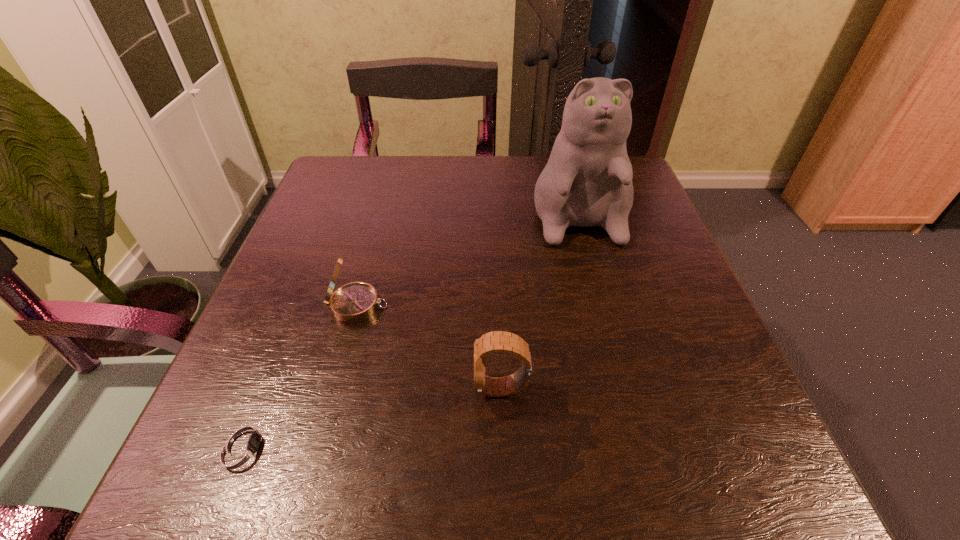
This screenshot has width=960, height=540. Identify the location of unoccupied area between the shortest object and the rightmost object. (409, 322).

Find the location of a particular element. This screenshot has width=960, height=540. vacant space that's between the taller watch and the leftmost object is located at coordinates (372, 417).

At what (x,y) coordinates should I click in order to perform the action: click on vacant space in between the shorter watch and the second object from right to left. Please return your answer as a coordinate pair (x, y). This screenshot has height=540, width=960. Looking at the image, I should click on (372, 417).

Where is `vacant space that's between the farther watch and the farthest object`? The image size is (960, 540). vacant space that's between the farther watch and the farthest object is located at coordinates (538, 293).

Identify the location of vacant region between the nearer watch and the farther watch. Image resolution: width=960 pixels, height=540 pixels. (372, 417).

I want to click on free space between the third object from left to right and the shortest object, so click(372, 417).

Locate which object is the second closest to the farther watch. Please provide its 2D coordinates. Your answer should be formatted as a tuple, i.e. [(x, y)], where the tuple contains the x and y coordinates of a point satisfying the conditions above.

[(242, 448)]

Locate which object ranks second in proximity to the compass. Please provide its 2D coordinates. Your answer should be formatted as a tuple, i.e. [(x, y)], where the tuple contains the x and y coordinates of a point satisfying the conditions above.

[(498, 341)]

Identify the location of free spot that satisfies the following two spatial constraints: 1. on the face of the farthest object; 2. on the face of the leftmost object. The image size is (960, 540). click(641, 446).

In order to click on vacant space that satisfies the following two spatial constraints: 1. on the face of the cat; 2. with the dial facing the compass in this screenshot , I will do `click(603, 306)`.